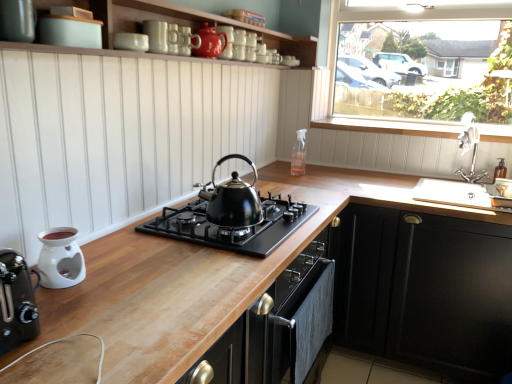
Where is `free spot in front of black metallic kettle at center`? Image resolution: width=512 pixels, height=384 pixels. free spot in front of black metallic kettle at center is located at coordinates (214, 259).